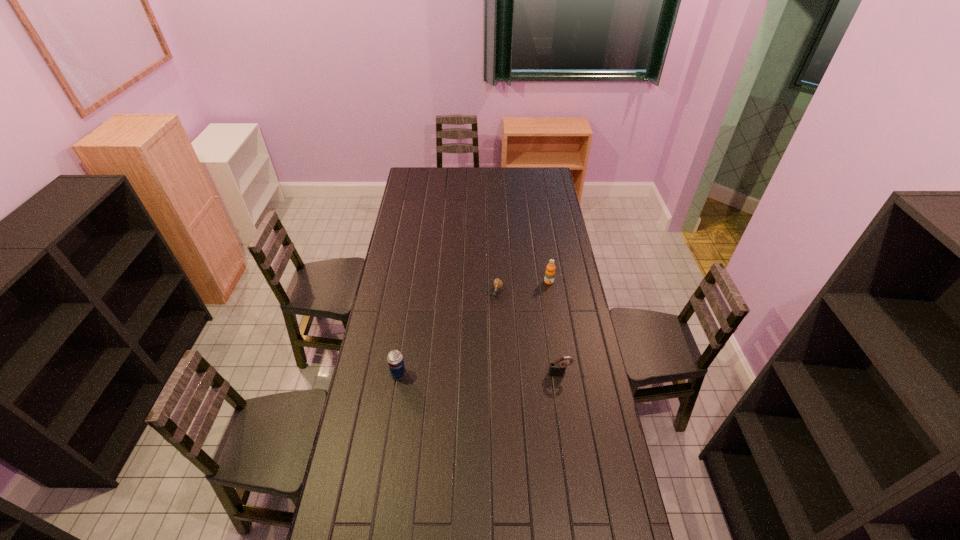
You are a GUI agent. You are given a task and a screenshot of the screen. Output one action in this format:
    pyautogui.click(x=<x>, y=<y>)
    Task: Click on the free space between the beer can and the escargot
    
    Given the screenshot: What is the action you would take?
    pyautogui.click(x=447, y=333)

I want to click on vacant area that lies between the orange juice and the shortest object, so click(523, 287).

You are a GUI agent. You are given a task and a screenshot of the screen. Output one action in this format:
    pyautogui.click(x=<x>, y=<y>)
    Task: Click on the vacant space that's between the beer can and the orange juice
    Image resolution: width=960 pixels, height=540 pixels.
    Given the screenshot: What is the action you would take?
    pyautogui.click(x=473, y=328)

Find the location of a particular element. vacant space that is in between the leftmost object and the orange juice is located at coordinates (473, 328).

The image size is (960, 540). I want to click on vacant region between the beer can and the padlock, so click(479, 374).

The image size is (960, 540). What are the coordinates of `free spot between the leftmost object and the shortest object` in the screenshot? It's located at (447, 333).

Where is `vacant space in between the beer can and the orange juice`? The image size is (960, 540). vacant space in between the beer can and the orange juice is located at coordinates (473, 328).

You are a GUI agent. You are given a task and a screenshot of the screen. Output one action in this format:
    pyautogui.click(x=<x>, y=<y>)
    Task: Click on the empty space between the shortest object and the padlock
    
    Given the screenshot: What is the action you would take?
    pyautogui.click(x=528, y=333)

This screenshot has height=540, width=960. What are the coordinates of `free space between the orange juice and the leftmost object` in the screenshot? It's located at (473, 328).

At what (x,y) coordinates should I click in order to perform the action: click on free spot between the second object from left to right and the padlock. Please return your answer as a coordinate pair (x, y). Image resolution: width=960 pixels, height=540 pixels. Looking at the image, I should click on (528, 333).